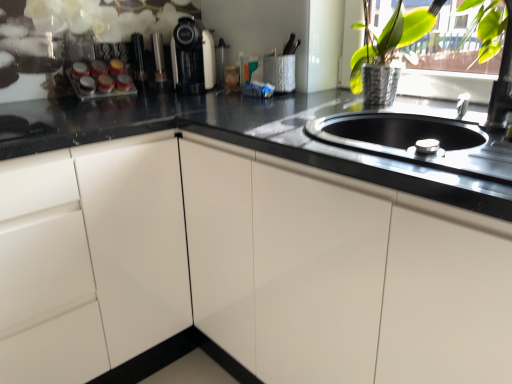
Question: From the image's perspective, relative to white glossy cabinet at left, is matte black coffee machine at upper center above or below?

Choices:
 (A) below
 (B) above

Answer: (B)

Question: From their relative heights in the image, would you say matte black coffee machine at upper center is taller or shorter than white glossy cabinet at left?

Choices:
 (A) tall
 (B) short

Answer: (B)

Question: Which is nearer to the metallic silver vase at upper right?

Choices:
 (A) white glossy cabinet at left
 (B) matte black coffee machine at upper center

Answer: (B)

Question: Which of these objects is positioned farthest from the white glossy cabinet at left?

Choices:
 (A) matte black coffee machine at upper center
 (B) metallic silver vase at upper right

Answer: (B)